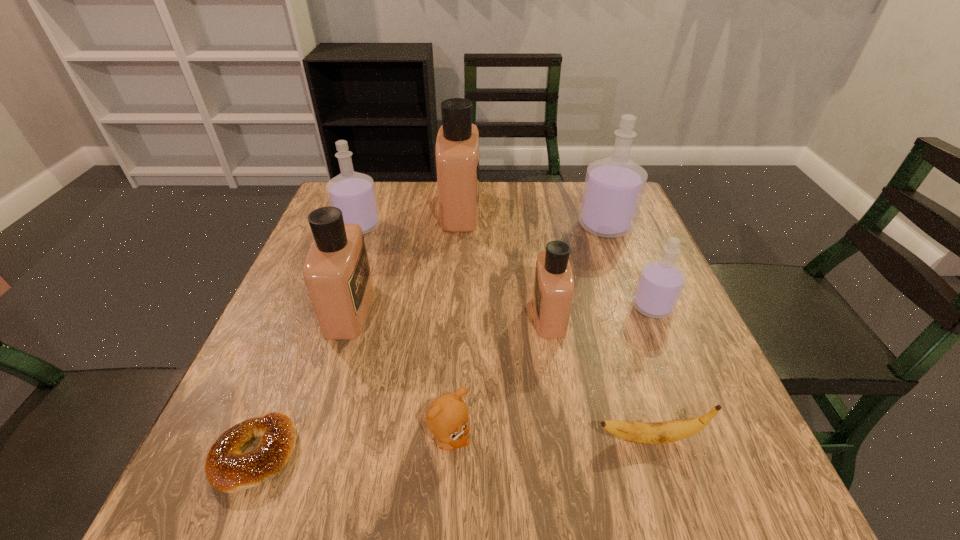
Where is `banana at the right edge`? banana at the right edge is located at coordinates (660, 432).

Locate an element on the screen. The height and width of the screenshot is (540, 960). object present at the far left corner is located at coordinates (353, 193).

I want to click on object present at the near left corner, so click(x=228, y=469).

Where is `object at the far right corner`? object at the far right corner is located at coordinates (614, 186).

The width and height of the screenshot is (960, 540). What are the coordinates of `blank area at the far edge` in the screenshot? It's located at (551, 191).

Where is `vacant region at the near edge of the desktop`? vacant region at the near edge of the desktop is located at coordinates (610, 501).

What are the coordinates of `vacant space at the left edge of the desktop` in the screenshot? It's located at (299, 354).

The height and width of the screenshot is (540, 960). In order to click on free space at the right edge of the desktop in this screenshot , I will do `click(622, 330)`.

You are a GUI agent. You are given a task and a screenshot of the screen. Output one action in this format:
    pyautogui.click(x=<x>, y=<y>)
    Task: Click on the blank space at the near right corner of the desktop
    Image resolution: width=960 pixels, height=540 pixels.
    Given the screenshot: What is the action you would take?
    pyautogui.click(x=743, y=484)

Identify the location of vacant space that is in between the smallest beige perfume and the fourth perfume from right to left. (504, 263).